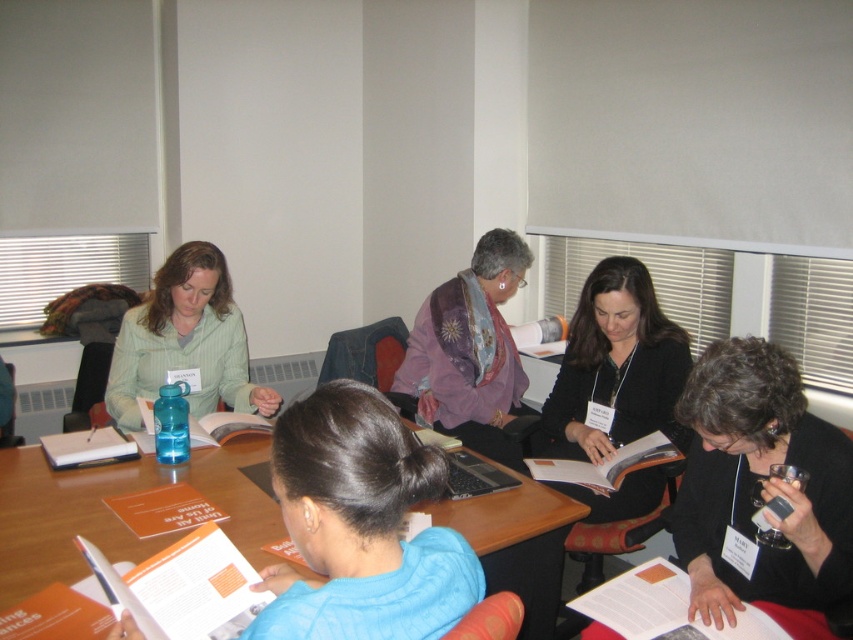
Question: Which of the following is the farthest from the observer?

Choices:
 (A) purple silk scarf at center
 (B) matte green shirt at upper left
 (C) black matte jacket at center

Answer: (A)

Question: Does black matte jacket at center appear on the left side of purple silk scarf at center?

Choices:
 (A) yes
 (B) no

Answer: (B)

Question: Which object appears farthest from the camera in this image?

Choices:
 (A) matte green shirt at upper left
 (B) wooden table at center
 (C) purple silk scarf at center
 (D) black matte jacket at center

Answer: (C)

Question: Does wooden table at center lie behind purple silk scarf at center?

Choices:
 (A) no
 (B) yes

Answer: (A)

Question: Estimate the real-world distances between objects in this image. Which object is closer to the purple silk scarf at center?

Choices:
 (A) black matte jacket at center
 (B) wooden table at center

Answer: (A)

Question: Observing the image, what is the correct spatial positioning of wooden table at center in reference to purple silk scarf at center?

Choices:
 (A) below
 (B) above

Answer: (A)